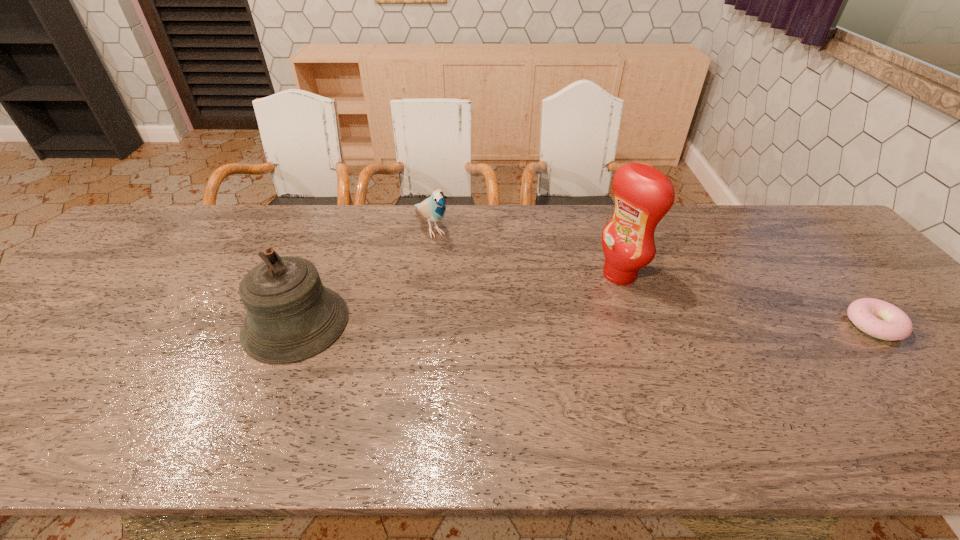
Identify the location of free space located 0.100m on the label side of the third object from left to right. This screenshot has width=960, height=540. (577, 299).

Find the location of a particular element. This screenshot has width=960, height=540. free point located on the label side of the third object from left to right is located at coordinates click(x=535, y=321).

In order to click on free region located on the label side of the third object from left to right in this screenshot , I will do `click(503, 338)`.

The height and width of the screenshot is (540, 960). Find the location of `vacant space located at the face of the second object from left to right`. vacant space located at the face of the second object from left to right is located at coordinates (474, 298).

What are the coordinates of `free space located 0.060m at the face of the second object from left to right` in the screenshot? It's located at (446, 259).

This screenshot has width=960, height=540. Find the location of `free location located at the face of the second object from left to right`. free location located at the face of the second object from left to right is located at coordinates (475, 300).

Find the location of a particular element. This screenshot has height=540, width=960. object that is at the far edge is located at coordinates pos(433,208).

Identify the location of object that is at the right edge. (877, 318).

Where is `vacant region at the far edge of the desktop`? vacant region at the far edge of the desktop is located at coordinates (479, 218).

In the image, there is a desktop. At what (x,y) coordinates should I click in order to perform the action: click on vacant region at the near edge. Please return your answer as a coordinate pair (x, y). The width and height of the screenshot is (960, 540). Looking at the image, I should click on (468, 393).